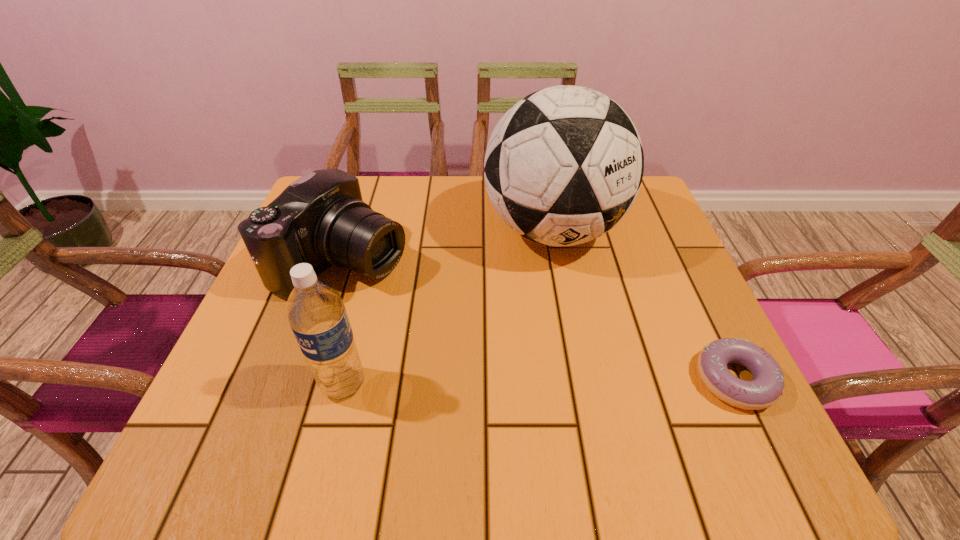
The height and width of the screenshot is (540, 960). I want to click on vacant region located on the lens of the second shortest object, so click(x=502, y=335).

At what (x,y) coordinates should I click in order to perform the action: click on blank space located on the surface of the soccer ball where the brand logo is visible. Please return your answer as a coordinate pair (x, y). This screenshot has height=540, width=960. Looking at the image, I should click on pyautogui.click(x=591, y=396).

This screenshot has height=540, width=960. Find the location of `free space located 0.070m on the surface of the soccer ball where the brand logo is visible`. free space located 0.070m on the surface of the soccer ball where the brand logo is visible is located at coordinates (570, 302).

Locate an element on the screen. This screenshot has height=540, width=960. free space located 0.090m on the surface of the soccer ball where the brand logo is visible is located at coordinates (571, 309).

Where is `camera present at the far edge`? camera present at the far edge is located at coordinates (321, 219).

Where is `soccer ball that is at the far edge`? soccer ball that is at the far edge is located at coordinates (564, 165).

Locate an element on the screen. The image size is (960, 540). water bottle present at the near edge is located at coordinates (317, 315).

Identify the location of doughnut that is at the near edge. (766, 388).

The width and height of the screenshot is (960, 540). Identify the location of object that is at the left edge. (321, 219).

At what (x,y) coordinates should I click in order to perform the action: click on doughnut that is at the right edge. Please return your answer as a coordinate pair (x, y). Looking at the image, I should click on (766, 388).